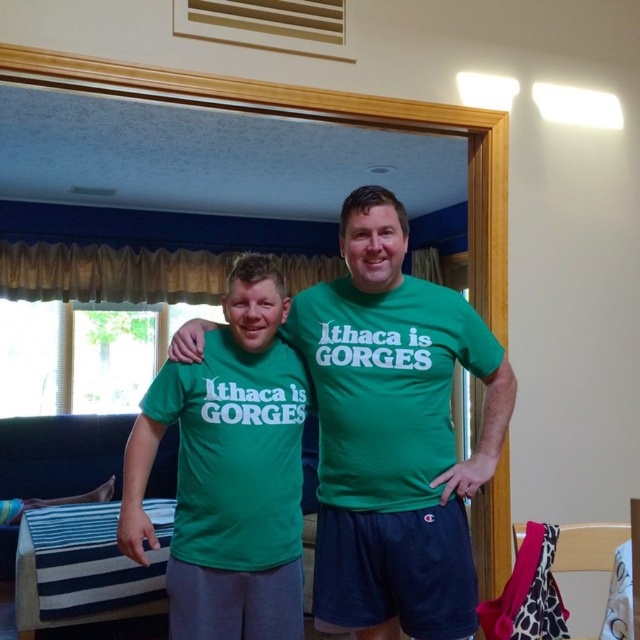
Based on the photo, you are a photographer trying to capture a closeup of the green matte t shirt at center. The camera you are using has a very narrow field of view. You need to know if the green matte t shirt at center is within the frame. Can you determine if the green matte t shirt at center is within the frame based on its position at point (394,433)?

The green matte t shirt at center is located at point (394,433), which is within the frame.